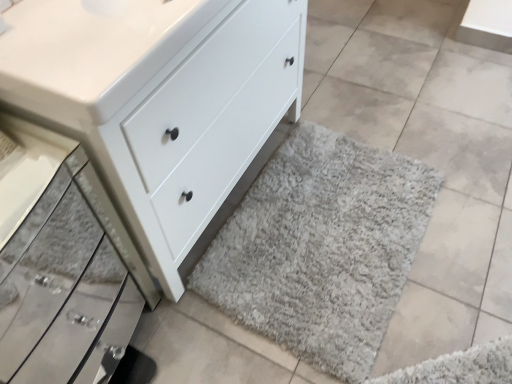
Where is `satin silver drawer at lower left`? The width and height of the screenshot is (512, 384). satin silver drawer at lower left is located at coordinates click(x=66, y=285).

Image resolution: width=512 pixels, height=384 pixels. What do you see at coordinates (321, 248) in the screenshot?
I see `gray shaggy rug at lower right` at bounding box center [321, 248].

Describe the element at coordinates (159, 100) in the screenshot. The image size is (512, 384). I see `white matte chest of drawers at lower center` at that location.

Where is `satin silver drawer at lower left`? This screenshot has width=512, height=384. satin silver drawer at lower left is located at coordinates 66,285.

Who is taller, satin silver drawer at lower left or white matte chest of drawers at lower center?

Standing taller between the two is white matte chest of drawers at lower center.

What's the angular difference between satin silver drawer at lower left and white matte chest of drawers at lower center's facing directions?

1.25 degrees separate the facing orientations of satin silver drawer at lower left and white matte chest of drawers at lower center.

Which of these two, satin silver drawer at lower left or white matte chest of drawers at lower center, is bigger?

white matte chest of drawers at lower center.

This screenshot has height=384, width=512. I want to click on drawer below the white matte chest of drawers at lower center (from the image's perspective), so click(66, 285).

From their relative heights in the image, would you say satin silver drawer at lower left is taller or shorter than white glossy sink at upper left?

Considering their sizes, satin silver drawer at lower left has more height than white glossy sink at upper left.

Is satin silver drawer at lower left not close to white glossy sink at upper left?

Actually, satin silver drawer at lower left and white glossy sink at upper left are a little close together.

Looking at this image, does satin silver drawer at lower left have a greater width compared to white glossy sink at upper left?

Yes.

Considering the positions of points (44, 12) and (38, 90), is point (44, 12) closer to camera compared to point (38, 90)?

That is False.

Would you say white glossy sink at upper left is outside white matte chest of drawers at lower center?

No, white glossy sink at upper left is inside or overlapping with white matte chest of drawers at lower center.

Between white glossy sink at upper left and white matte chest of drawers at lower center, which one has larger size?

With larger size is white matte chest of drawers at lower center.

How different are the orientations of white glossy sink at upper left and white matte chest of drawers at lower center in degrees?

white glossy sink at upper left and white matte chest of drawers at lower center are facing 0.843 degrees away from each other.

Would you consider satin silver drawer at lower left to be distant from gray shaggy rug at lower right?

No, there isn't a large distance between satin silver drawer at lower left and gray shaggy rug at lower right.

From the image's perspective, would you say satin silver drawer at lower left is positioned over gray shaggy rug at lower right?

No, from the image's perspective, satin silver drawer at lower left is not above gray shaggy rug at lower right.

Is satin silver drawer at lower left thinner than gray shaggy rug at lower right?

Correct, the width of satin silver drawer at lower left is less than that of gray shaggy rug at lower right.

Consider the image. From the image's perspective, which is above, white matte chest of drawers at lower center or gray shaggy rug at lower right?

white matte chest of drawers at lower center is shown above in the image.

From a real-world perspective, is white matte chest of drawers at lower center positioned above or below gray shaggy rug at lower right?

Clearly, from a real-world perspective, white matte chest of drawers at lower center is above gray shaggy rug at lower right.

In terms of size, does white matte chest of drawers at lower center appear bigger or smaller than gray shaggy rug at lower right?

white matte chest of drawers at lower center is bigger than gray shaggy rug at lower right.

In the scene shown: Are gray shaggy rug at lower right and white glossy sink at upper left beside each other?

No, gray shaggy rug at lower right is not touching white glossy sink at upper left.

From a real-world perspective, is gray shaggy rug at lower right physically below white glossy sink at upper left?

Indeed, from a real-world perspective, gray shaggy rug at lower right is positioned beneath white glossy sink at upper left.

Considering the positions of objects gray shaggy rug at lower right and white glossy sink at upper left in the image provided, who is more to the left, gray shaggy rug at lower right or white glossy sink at upper left?

white glossy sink at upper left.

Is gray shaggy rug at lower right further to camera compared to white glossy sink at upper left?

Yes.

Is white matte chest of drawers at lower center positioned with its back to satin silver drawer at lower left?

No, white matte chest of drawers at lower center's orientation is not away from satin silver drawer at lower left.

Does white matte chest of drawers at lower center have a lesser width compared to satin silver drawer at lower left?

No.

From the image's perspective, which is above, white matte chest of drawers at lower center or satin silver drawer at lower left?

white matte chest of drawers at lower center appears higher in the image.

Locate an element on the screen. Image resolution: width=512 pixels, height=384 pixels. chest of drawers on the right of the satin silver drawer at lower left is located at coordinates (159, 100).

Identify the location of drawer that is on the left side of white glossy sink at upper left. The height and width of the screenshot is (384, 512). (66, 285).

Based on their spatial positions, is satin silver drawer at lower left or white glossy sink at upper left further from white matte chest of drawers at lower center?

satin silver drawer at lower left is positioned further to the anchor white matte chest of drawers at lower center.

When comparing their distances from white glossy sink at upper left, does gray shaggy rug at lower right or white matte chest of drawers at lower center seem further?

The object further to white glossy sink at upper left is gray shaggy rug at lower right.

In the scene shown: Estimate the real-world distances between objects in this image. Which object is further from white matte chest of drawers at lower center, gray shaggy rug at lower right or white glossy sink at upper left?

Among the two, gray shaggy rug at lower right is located further to white matte chest of drawers at lower center.

Considering their positions, is white matte chest of drawers at lower center positioned closer to satin silver drawer at lower left than white glossy sink at upper left?

white matte chest of drawers at lower center lies closer to satin silver drawer at lower left than the other object.

From the image, which object appears to be nearer to white matte chest of drawers at lower center, white glossy sink at upper left or satin silver drawer at lower left?

Based on the image, white glossy sink at upper left appears to be nearer to white matte chest of drawers at lower center.

Looking at the image, which one is located closer to gray shaggy rug at lower right, white glossy sink at upper left or white matte chest of drawers at lower center?

The object closer to gray shaggy rug at lower right is white matte chest of drawers at lower center.

Considering their positions, is satin silver drawer at lower left positioned closer to white matte chest of drawers at lower center than gray shaggy rug at lower right?

satin silver drawer at lower left is closer to white matte chest of drawers at lower center.

Based on their spatial positions, is gray shaggy rug at lower right or satin silver drawer at lower left closer to white matte chest of drawers at lower center?

Based on the image, satin silver drawer at lower left appears to be nearer to white matte chest of drawers at lower center.

This screenshot has width=512, height=384. Find the location of `the chest of drawers that lies between white glossy sink at upper left and gray shaggy rug at lower right from top to bottom`. the chest of drawers that lies between white glossy sink at upper left and gray shaggy rug at lower right from top to bottom is located at coordinates (159, 100).

Locate an element on the screen. Image resolution: width=512 pixels, height=384 pixels. counter top between satin silver drawer at lower left and gray shaggy rug at lower right from left to right is located at coordinates point(91,53).

Find the location of `the chest of drawers situated between satin silver drawer at lower left and gray shaggy rug at lower right from left to right`. the chest of drawers situated between satin silver drawer at lower left and gray shaggy rug at lower right from left to right is located at coordinates (159, 100).

Locate an element on the screen. The image size is (512, 384). the chest of drawers between white glossy sink at upper left and satin silver drawer at lower left vertically is located at coordinates coord(159,100).